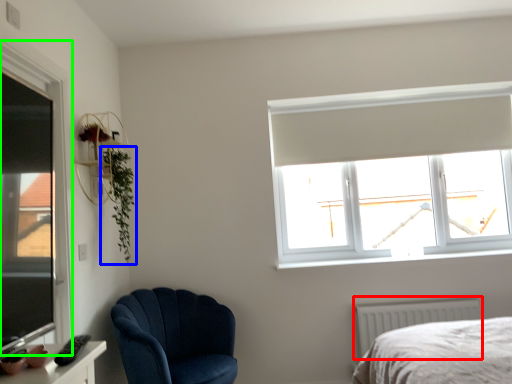
Question: Which object is the closest to the radiator (highlighted by a red box)? Choose among these: plant (highlighted by a blue box) or window (highlighted by a green box).

Choices:
 (A) plant
 (B) window

Answer: (A)